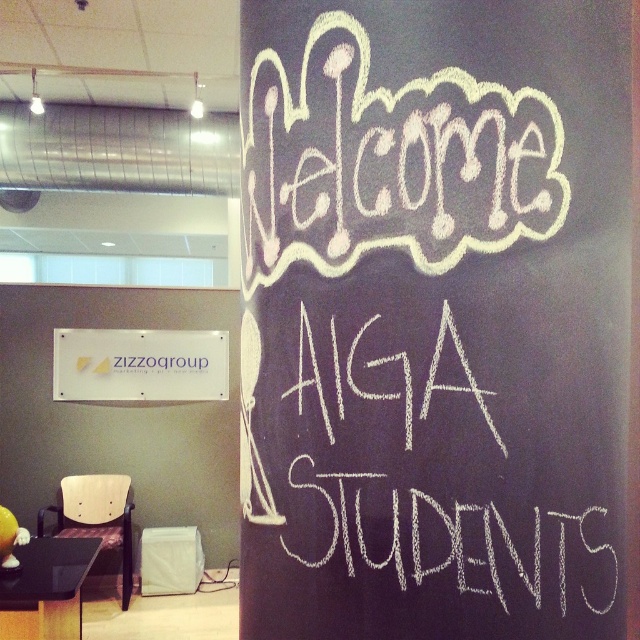
You are an interior designer planning to hang a new decorative item in the office. You notice the white chalkboard at upper center and the white plastic sign at upper left. Which object is taller and would require a higher hanging space?

The white chalkboard at upper center is much taller than the white plastic sign at upper left, so it would require a higher hanging space.

You are standing in the office and need to place a 10 feet long banner between the white chalkboard at upper center and the white plastic sign at upper left. Will the banner fit without overlapping either object?

The distance between the white chalkboard at upper center and the white plastic sign at upper left is 12.76 feet. Since the banner is 10 feet long, it will fit between them without overlapping either object as there is enough space.